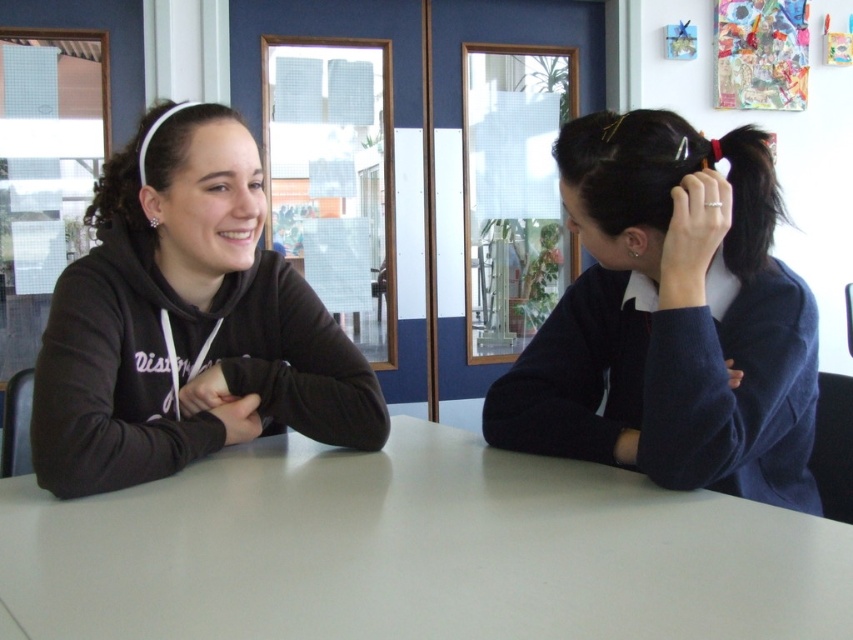
Does point (738, 227) lie behind point (86, 420)?

That is False.

Between point (596, 321) and point (207, 232), which one is positioned in front?

Point (207, 232) is more forward.

Locate an element on the screen. The width and height of the screenshot is (853, 640). dark blue sweater at right is located at coordinates (671, 320).

Measure the distance from white glossy table at center to matte black hoodie at left.

white glossy table at center and matte black hoodie at left are 30.19 centimeters apart.

Is white glossy table at center bigger than matte black hoodie at left?

Actually, white glossy table at center might be smaller than matte black hoodie at left.

Where is `white glossy table at center`? The image size is (853, 640). white glossy table at center is located at coordinates (415, 552).

Which is more to the left, white glossy table at center or dark blue sweater at right?

white glossy table at center

Between white glossy table at center and dark blue sweater at right, which one appears on the right side from the viewer's perspective?

Positioned to the right is dark blue sweater at right.

Where is `white glossy table at center`? This screenshot has height=640, width=853. white glossy table at center is located at coordinates (415, 552).

Find the location of a particular element. white glossy table at center is located at coordinates (415, 552).